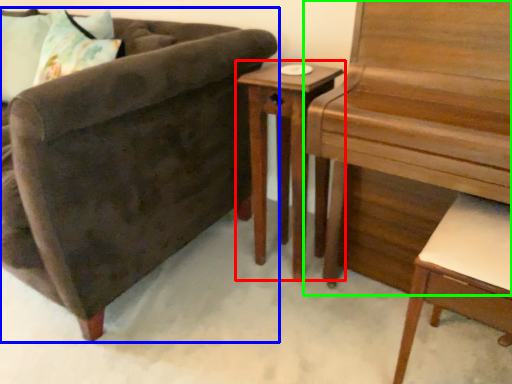
Question: Which object is the farthest from nightstand (highlighted by a red box)? Choose among these: chair (highlighted by a blue box) or piano (highlighted by a green box).

Choices:
 (A) chair
 (B) piano

Answer: (A)